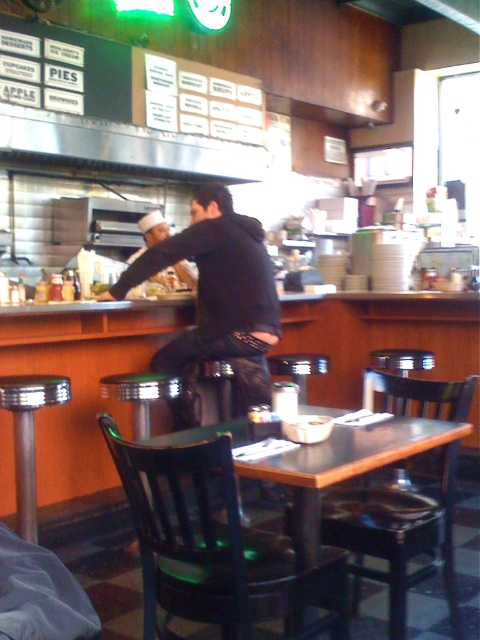
From the picture: Between black wood chair at table and shiny chrome bar stool at lower left, which one is positioned higher?

shiny chrome bar stool at lower left is higher up.

Does point (164, 524) come behind point (15, 448)?

No, it is not.

Is point (222, 570) more distant than point (15, 448)?

No.

The height and width of the screenshot is (640, 480). I want to click on black wood chair at table, so click(x=216, y=547).

Is black wood chair at lower center to the left of shiny chrome bar stool at lower left from the viewer's perspective?

In fact, black wood chair at lower center is to the right of shiny chrome bar stool at lower left.

From the picture: Does black wood chair at lower center lie in front of shiny chrome bar stool at lower left?

That is True.

Measure the distance between point [403,387] and camera.

Point [403,387] and camera are 7.72 feet apart.

Identify the location of black wood chair at lower center. The height and width of the screenshot is (640, 480). (399, 532).

Does black wood chair at table have a greater height compared to black wood chair at lower center?

No.

Is black wood chair at table to the left of black wood chair at lower center from the viewer's perspective?

Indeed, black wood chair at table is positioned on the left side of black wood chair at lower center.

Describe the element at coordinates (216, 547) in the screenshot. This screenshot has height=640, width=480. I see `black wood chair at table` at that location.

At what (x,y) coordinates should I click in order to perform the action: click on black wood chair at table. Please return your answer as a coordinate pair (x, y). The width and height of the screenshot is (480, 640). Looking at the image, I should click on (216, 547).